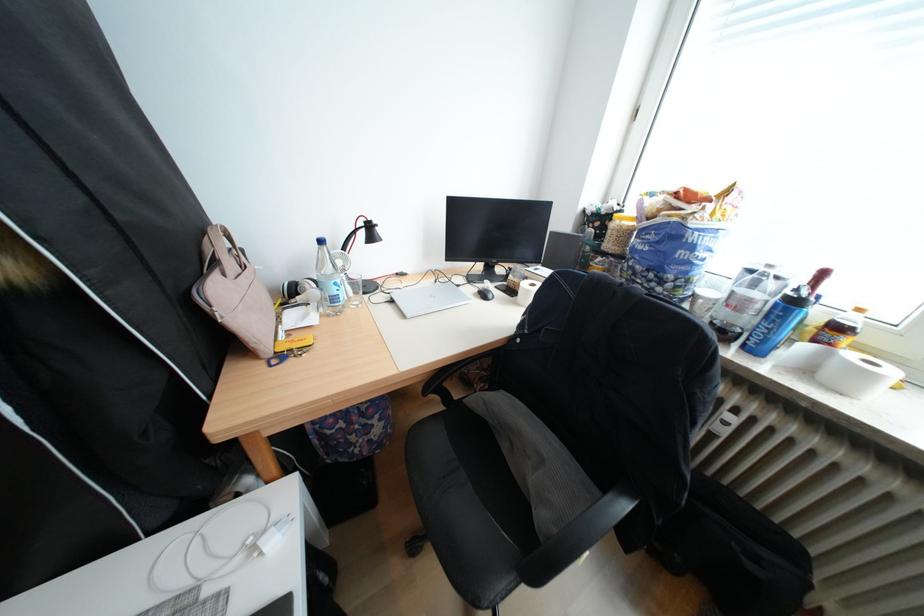
Where is `glass snack jar`? The width and height of the screenshot is (924, 616). glass snack jar is located at coordinates click(746, 301).